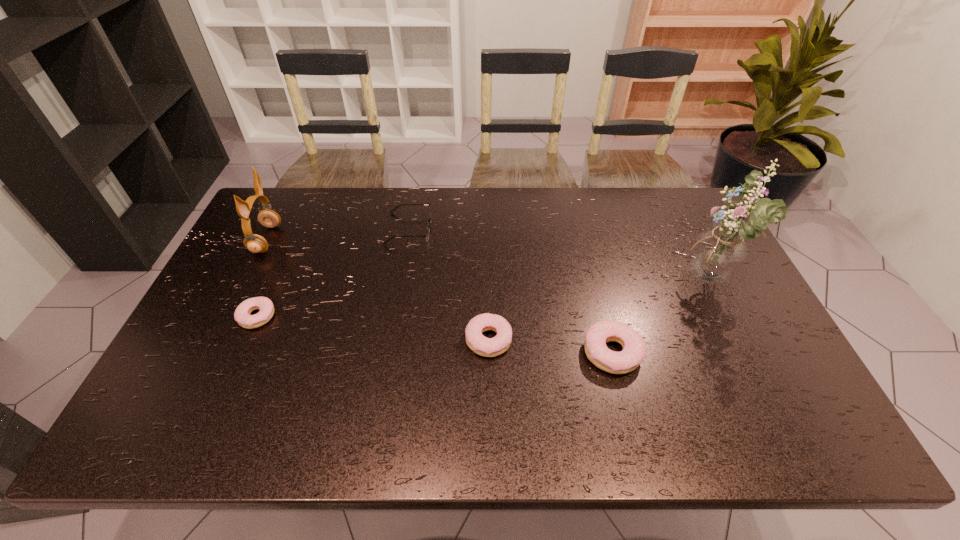
Please point a spot to place another doughnut for symmetrical spacing. Please provide its 2D coordinates. Your answer should be formatted as a tuple, i.e. [(x, y)], where the tuple contains the x and y coordinates of a point satisfying the conditions above.

[(371, 328)]